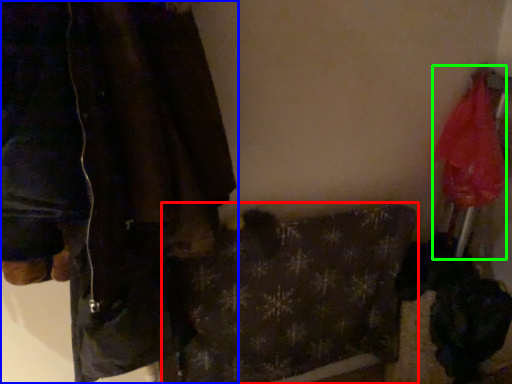
Question: Which object is the farthest from blanket (highlighted by a red box)? Choose among these: jacket (highlighted by a blue box) or umbrella (highlighted by a green box).

Choices:
 (A) jacket
 (B) umbrella

Answer: (B)